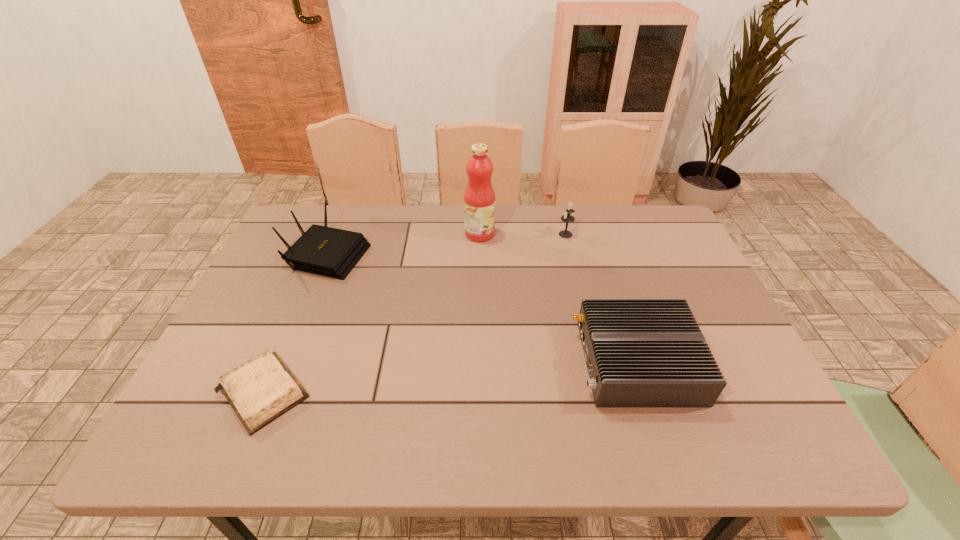
Identify the location of vacant space situated on the back panel of the nearer router. tap(456, 362).

The image size is (960, 540). What are the coordinates of `free location located on the back panel of the nearer router` in the screenshot? It's located at (407, 362).

Where is `free space located on the back panel of the nearer router`? The width and height of the screenshot is (960, 540). free space located on the back panel of the nearer router is located at coordinates (555, 362).

Locate an element on the screen. Image resolution: width=960 pixels, height=540 pixels. fruit juice located at the far edge is located at coordinates (479, 198).

Image resolution: width=960 pixels, height=540 pixels. In order to click on candle holder at the far edge in this screenshot , I will do `click(567, 218)`.

The width and height of the screenshot is (960, 540). I want to click on router situated at the far edge, so click(321, 250).

The image size is (960, 540). In order to click on object that is positioned at the near edge in this screenshot , I will do `click(260, 390)`.

Where is `router located in the left edge section of the desktop`? router located in the left edge section of the desktop is located at coordinates (321, 250).

Find the location of a particular element. diary situated at the left edge is located at coordinates (260, 390).

The width and height of the screenshot is (960, 540). Find the location of `object located in the right edge section of the desktop`. object located in the right edge section of the desktop is located at coordinates (639, 352).